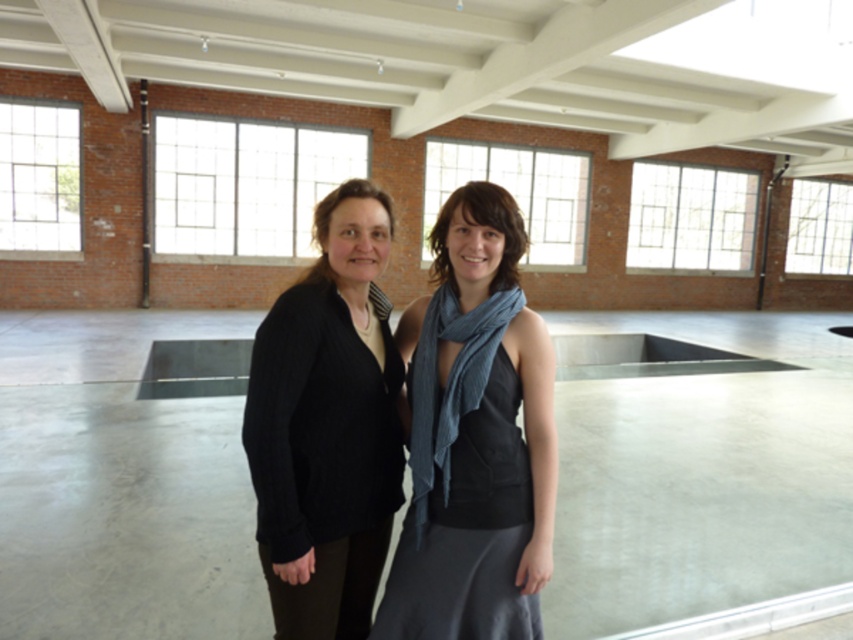
Question: Which object is closer to the camera taking this photo?

Choices:
 (A) black knit sweater at center
 (B) blue textured scarf at center

Answer: (A)

Question: Is dark gray fabric dress at center wider than blue textured scarf at center?

Choices:
 (A) no
 (B) yes

Answer: (B)

Question: Is black knit sweater at center closer to the viewer compared to blue textured scarf at center?

Choices:
 (A) no
 (B) yes

Answer: (B)

Question: Among these objects, which one is nearest to the camera?

Choices:
 (A) blue textured scarf at center
 (B) black knit sweater at center
 (C) dark gray fabric dress at center

Answer: (B)

Question: Which point is closer to the camera taking this photo?

Choices:
 (A) (361, 339)
 (B) (503, 500)

Answer: (B)

Question: Is dark gray fabric dress at center to the right of black knit sweater at center from the viewer's perspective?

Choices:
 (A) yes
 (B) no

Answer: (A)